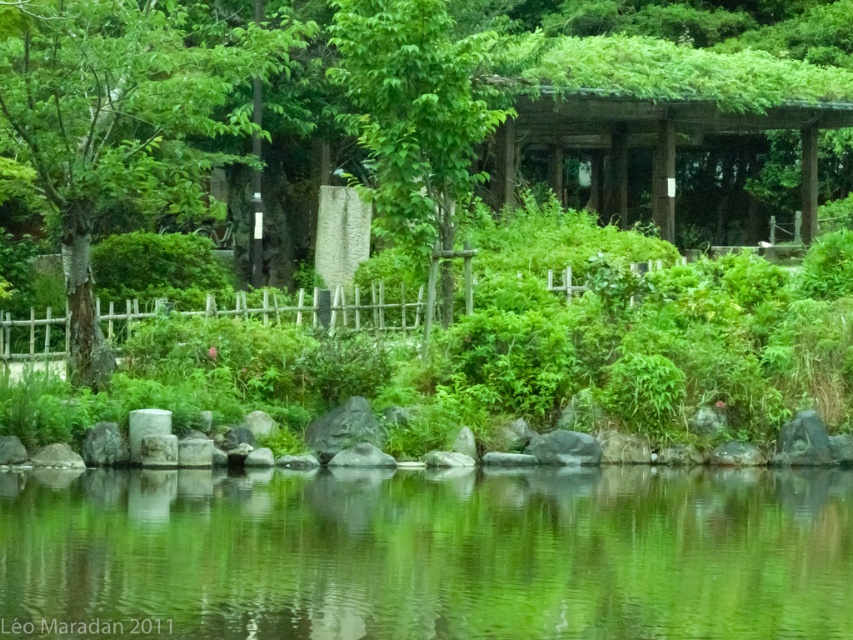
Question: Which point is farther to the camera?

Choices:
 (A) (352, 68)
 (B) (791, 104)

Answer: (B)

Question: Can you confirm if green leafy tree at left is wider than green leafy tree at center?

Choices:
 (A) yes
 (B) no

Answer: (A)

Question: Is green reflective water at center below green leafy tree at center?

Choices:
 (A) no
 (B) yes

Answer: (B)

Question: Among these points, which one is farthest from the camera?

Choices:
 (A) (517, 410)
 (B) (413, 189)
 (C) (659, 83)
 (D) (172, 563)

Answer: (C)

Question: Which point is farther to the camera?

Choices:
 (A) (531, 77)
 (B) (796, 580)
 (C) (184, 172)

Answer: (A)

Question: Considering the relative positions of green leafy bush at center and green leafy tree at left in the image provided, where is green leafy bush at center located with respect to green leafy tree at left?

Choices:
 (A) below
 (B) above

Answer: (A)